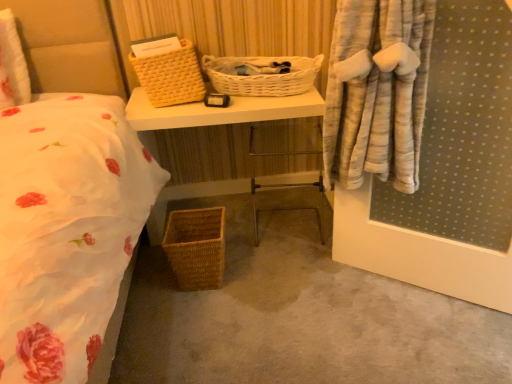
Where is `free space on the front side of woven brown picnic basket at lower center, the 1th picnic basket from the bottom`? This screenshot has width=512, height=384. free space on the front side of woven brown picnic basket at lower center, the 1th picnic basket from the bottom is located at coordinates (194, 317).